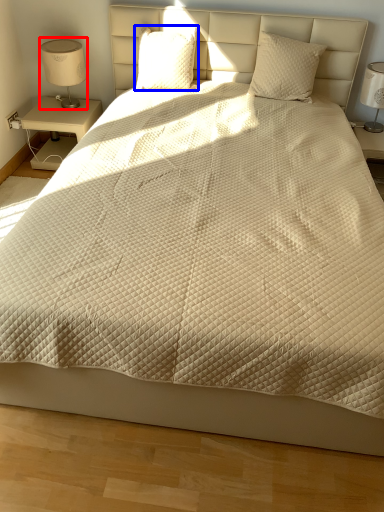
Question: Which of the following is the closest to the observer, table lamp (highlighted by a red box) or pillow (highlighted by a blue box)?

Choices:
 (A) table lamp
 (B) pillow

Answer: (B)